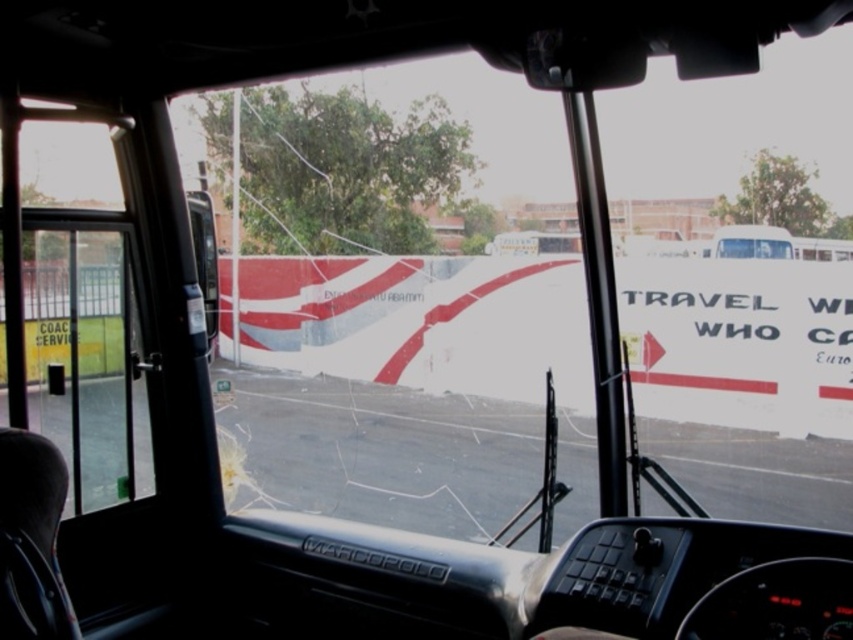
Question: Which of the following is the farthest from the observer?

Choices:
 (A) (10, 131)
 (B) (469, 422)

Answer: (B)

Question: In this image, where is transparent glass at center located relative to white glossy bus driver at center?

Choices:
 (A) above
 (B) below

Answer: (A)

Question: Which object appears closest to the camera in this image?

Choices:
 (A) transparent glass at center
 (B) clear glass door at left

Answer: (B)

Question: Estimate the real-world distances between objects in this image. Which object is closer to the clear glass door at left?

Choices:
 (A) white glossy bus driver at center
 (B) transparent glass at center

Answer: (B)

Question: Is clear glass door at left closer to camera compared to white glossy bus driver at center?

Choices:
 (A) yes
 (B) no

Answer: (A)

Question: Is transparent glass at center positioned before clear glass door at left?

Choices:
 (A) no
 (B) yes

Answer: (A)